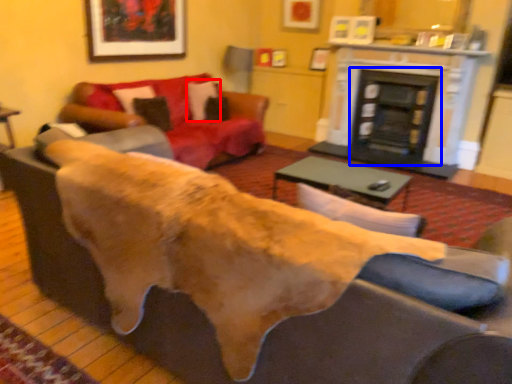
Question: Which of the following is the closest to the observer, pillow (highlighted by a red box) or fireplace (highlighted by a blue box)?

Choices:
 (A) pillow
 (B) fireplace

Answer: (A)